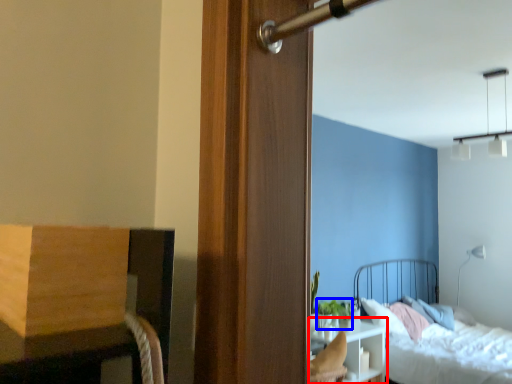
Question: Which object is closer to the camera taking this photo, nightstand (highlighted by a red box) or plant (highlighted by a blue box)?

Choices:
 (A) nightstand
 (B) plant

Answer: (A)